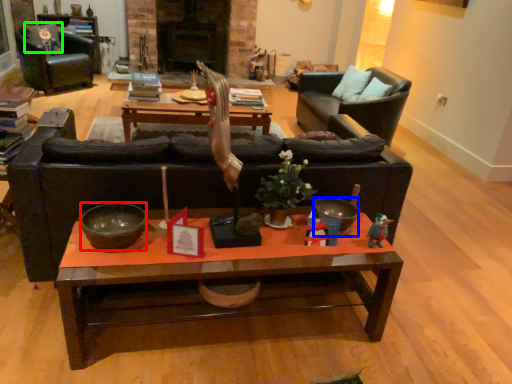
Question: Based on their relative distances, which object is farther from bowl (highlighted by a red box)? Choose from bowl (highlighted by a blue box) and pillow (highlighted by a green box).

Choices:
 (A) bowl
 (B) pillow

Answer: (B)